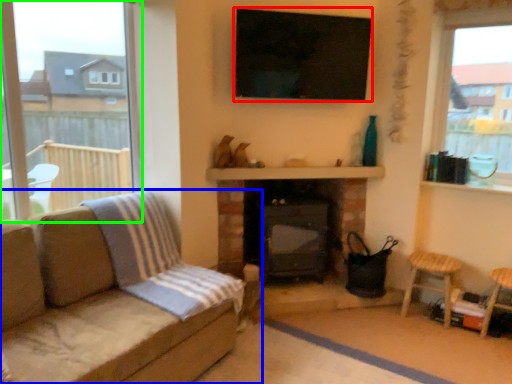
Question: Based on their relative distances, which object is nearer to window screen (highlighted by a red box)? Choose from studio couch (highlighted by a blue box) and window (highlighted by a green box).

Choices:
 (A) studio couch
 (B) window

Answer: (A)